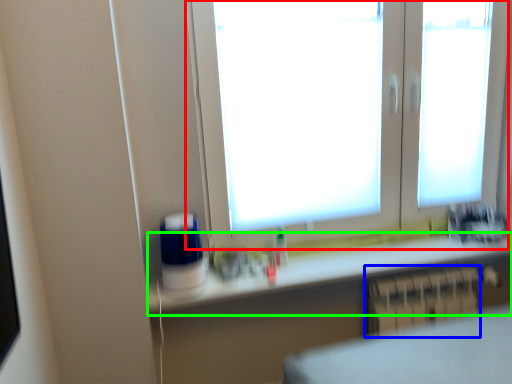
Question: Estimate the real-world distances between objects in this image. Which object is closer to window (highlighted by a red box), radiator (highlighted by a blue box) or counter top (highlighted by a green box)?

Choices:
 (A) radiator
 (B) counter top

Answer: (B)